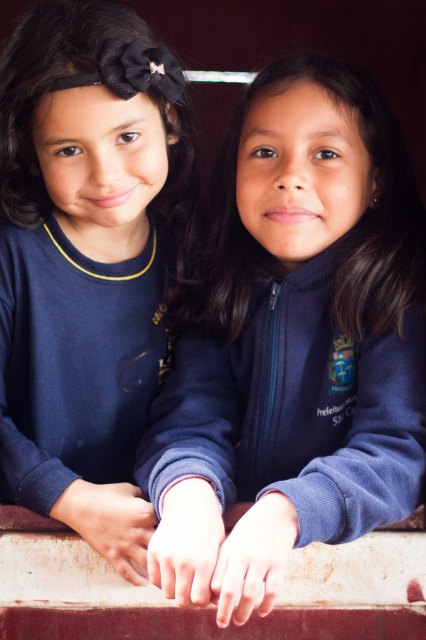
Does point (400, 477) come in front of point (152, 173)?

That is True.

Who is higher up, matte blue sweatshirt at center or navy blue sweatshirt at left?

navy blue sweatshirt at left is above.

Is point (218, 582) in front of point (161, 108)?

Yes, it is in front of point (161, 108).

Locate an element on the screen. The image size is (426, 640). matte blue sweatshirt at center is located at coordinates (294, 342).